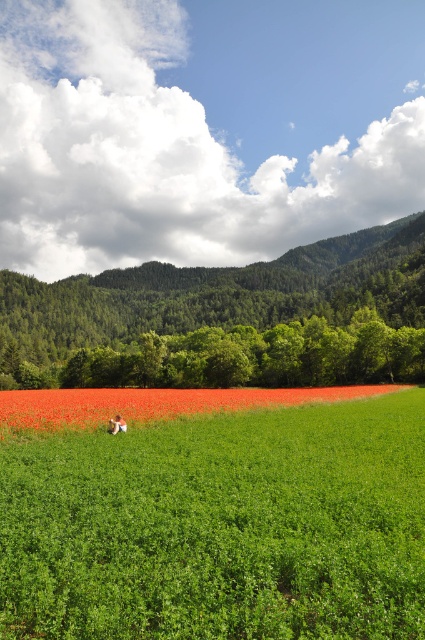
Question: Observing the image, what is the correct spatial positioning of bright red petals at center in reference to light brown hair at center?

Choices:
 (A) above
 (B) below

Answer: (B)

Question: Observing the image, what is the correct spatial positioning of green grassy field at center in reference to light brown hair at center?

Choices:
 (A) above
 (B) below

Answer: (A)

Question: Which point is closer to the camera?

Choices:
 (A) light brown hair at center
 (B) bright red petals at center
 (C) green forested mountain at center
 (D) green grassy field at center

Answer: (D)

Question: Is bright red petals at center closer to the viewer compared to light brown hair at center?

Choices:
 (A) yes
 (B) no

Answer: (A)

Question: Estimate the real-world distances between objects in this image. Which object is farther from the green forested mountain at center?

Choices:
 (A) light brown hair at center
 (B) green grassy field at center

Answer: (A)

Question: Which is nearer to the bright red petals at center?

Choices:
 (A) light brown hair at center
 (B) green forested mountain at center
 (C) green grassy field at center

Answer: (C)